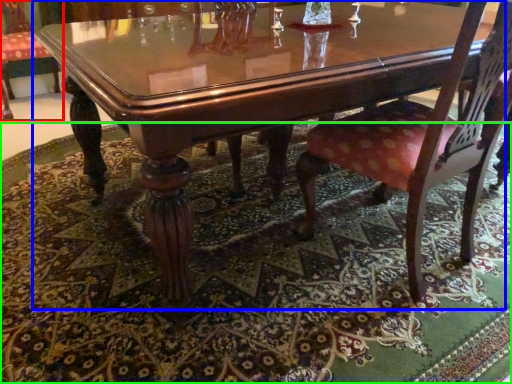
Question: Which object is positioned farthest from chair (highlighted by a red box)? Select from coffee table (highlighted by a blue box) and place mat (highlighted by a green box).

Choices:
 (A) coffee table
 (B) place mat

Answer: (A)